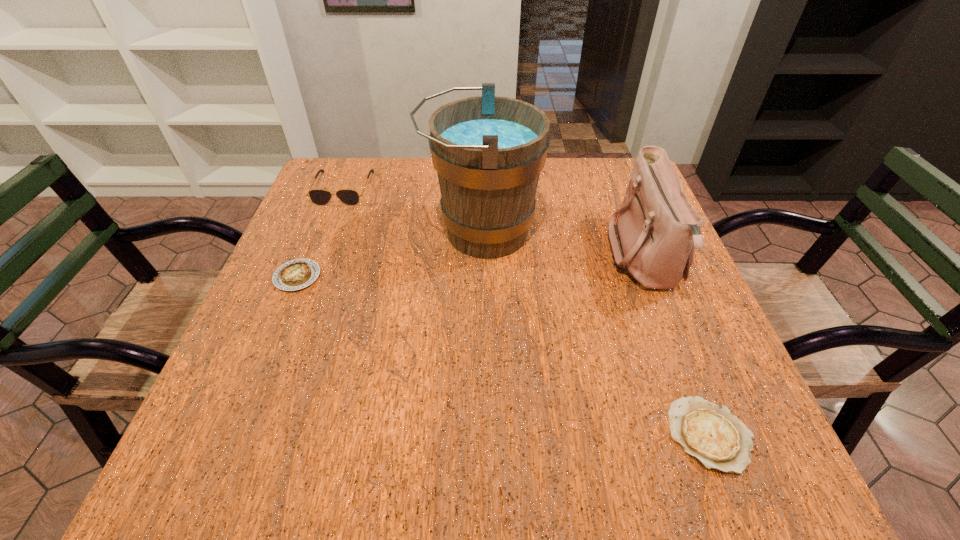
Find the location of a particular element. Image resolution: width=960 pixels, height=540 pixels. quiche at the left edge is located at coordinates click(299, 273).

The width and height of the screenshot is (960, 540). What are the coordinates of `shoulder bag present at the right edge` in the screenshot? It's located at (657, 229).

Locate an element on the screen. The width and height of the screenshot is (960, 540). quiche at the right edge is located at coordinates (711, 433).

Find the location of a particular element. object present at the far left corner is located at coordinates (320, 197).

Identify the location of object that is at the near right corner. The height and width of the screenshot is (540, 960). (711, 433).

This screenshot has width=960, height=540. In the image, there is a desktop. Identify the location of vacant area at the far edge. pos(578,166).

Find the location of a particular element. The width and height of the screenshot is (960, 540). vacant region at the near edge of the desktop is located at coordinates (383, 442).

At what (x,y) coordinates should I click in order to perform the action: click on free spot at the left edge of the desktop. Please return your answer as a coordinate pair (x, y). Looking at the image, I should click on (321, 242).

Where is `vacant space at the right edge of the desktop`? vacant space at the right edge of the desktop is located at coordinates (673, 391).

Find the location of a particular element. This screenshot has height=540, width=960. free space at the far left corner of the desktop is located at coordinates pyautogui.click(x=347, y=172).